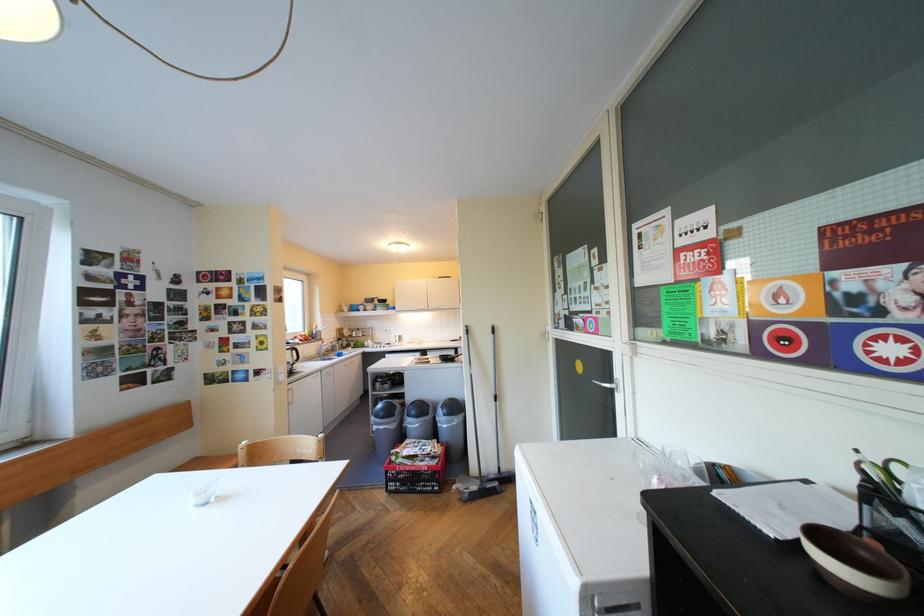
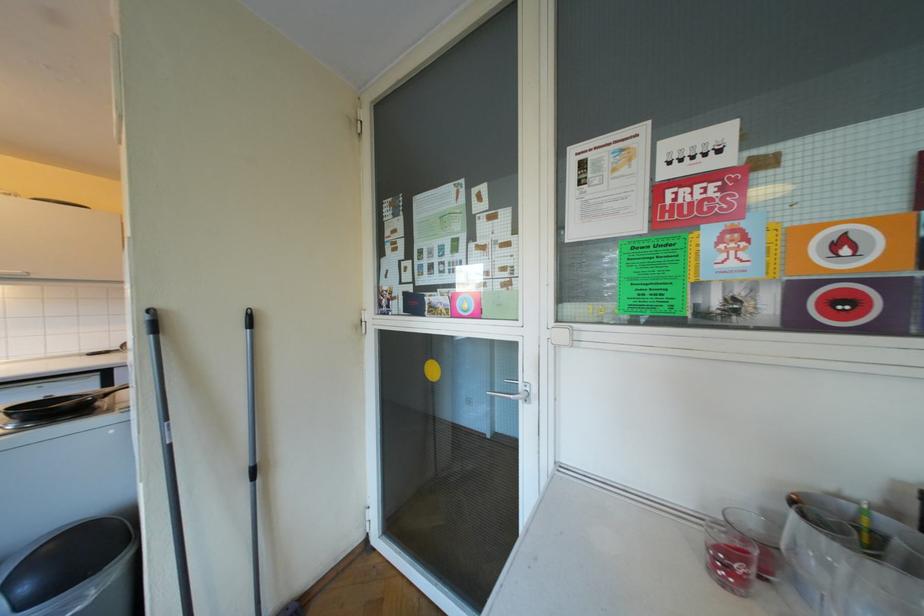
Question: How did the camera likely rotate?

Choices:
 (A) Left
 (B) Right
 (C) Up
 (D) Down

Answer: (B)